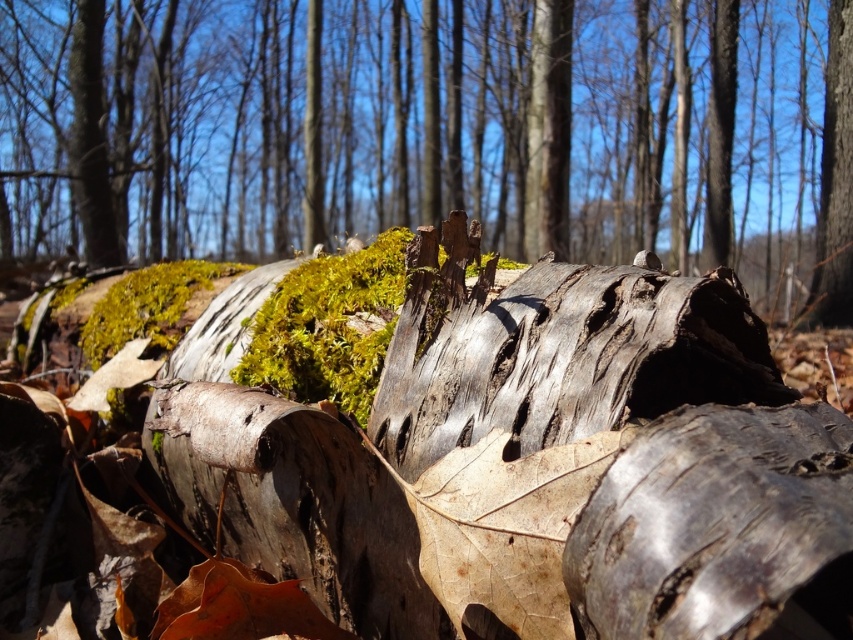
Question: Does rough bark log at center have a smaller size compared to smooth brown bark at center?

Choices:
 (A) no
 (B) yes

Answer: (A)

Question: Which point is closer to the camera taking this photo?

Choices:
 (A) (846, 241)
 (B) (83, 38)

Answer: (A)

Question: Which object appears farthest from the camera in this image?

Choices:
 (A) smooth bark tree trunk at upper right
 (B) rough bark log at center
 (C) smooth brown bark at center

Answer: (C)

Question: Can you confirm if rough bark log at center is bigger than smooth brown bark at center?

Choices:
 (A) no
 (B) yes

Answer: (B)

Question: Does rough bark log at center have a lesser width compared to smooth bark tree trunk at upper right?

Choices:
 (A) yes
 (B) no

Answer: (B)

Question: Which of the following is the farthest from the observer?

Choices:
 (A) (76, 44)
 (B) (308, 188)

Answer: (B)